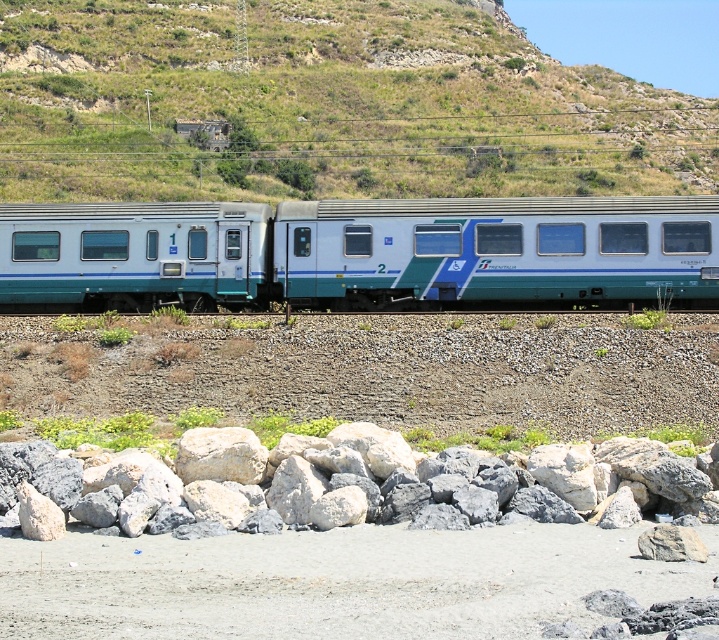
Between green grassy hillside at upper center and white glossy train car at center, which one has less height?

With less height is white glossy train car at center.

Measure the distance between green grassy hillside at upper center and white glossy train car at center.

A distance of 60.31 meters exists between green grassy hillside at upper center and white glossy train car at center.

You are a GUI agent. You are given a task and a screenshot of the screen. Output one action in this format:
    pyautogui.click(x=<x>, y=<y>)
    Task: Click on the green grassy hillside at upper center
    Image resolution: width=719 pixels, height=640 pixels.
    Given the screenshot: What is the action you would take?
    pyautogui.click(x=324, y=106)

Can you confirm if green grassy hillside at upper center is taller than matte blue train car at left?

Yes, green grassy hillside at upper center is taller than matte blue train car at left.

Is green grassy hillside at upper center above matte blue train car at left?

Indeed, green grassy hillside at upper center is positioned over matte blue train car at left.

At what (x,y) coordinates should I click in order to perform the action: click on green grassy hillside at upper center. Please return your answer as a coordinate pair (x, y). This screenshot has height=640, width=719. Looking at the image, I should click on (324, 106).

Is white glossy train car at center to the left of matte blue train car at left from the viewer's perspective?

No, white glossy train car at center is not to the left of matte blue train car at left.

Between white glossy train car at center and matte blue train car at left, which one has less height?

With less height is matte blue train car at left.

Is point (622, 227) more distant than point (124, 257)?

No, (622, 227) is in front of (124, 257).

This screenshot has width=719, height=640. Find the location of `white glossy train car at center`. white glossy train car at center is located at coordinates (360, 252).